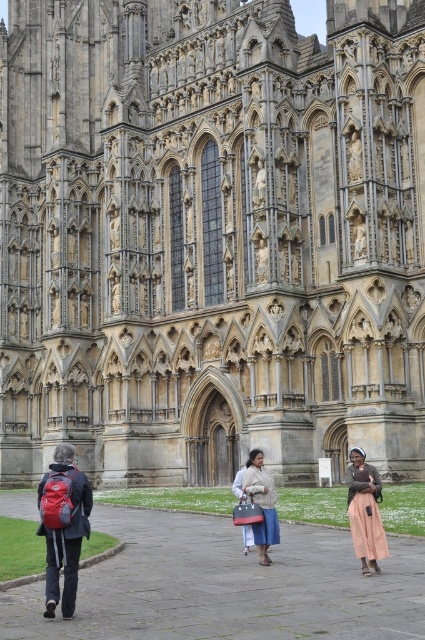
Question: Does peach cotton dress at lower right have a smaller size compared to light brown fabric coat at center?

Choices:
 (A) yes
 (B) no

Answer: (A)

Question: Which object is the farthest from the peach cotton dress at lower right?

Choices:
 (A) light brown fabric coat at center
 (B) light brown fabric bag at center

Answer: (B)

Question: From the image, what is the correct spatial relationship of peach cotton dress at lower right in relation to light brown fabric coat at center?

Choices:
 (A) left
 (B) right

Answer: (B)

Question: Which point is farther to the camera?

Choices:
 (A) light brown fabric coat at center
 (B) light brown fabric bag at center
 (C) red fabric backpack at lower left

Answer: (B)

Question: Based on their relative distances, which object is farther from the peach cotton dress at lower right?

Choices:
 (A) light brown fabric bag at center
 (B) red fabric backpack at lower left

Answer: (B)

Question: Is peach cotton dress at lower right positioned before light brown fabric bag at center?

Choices:
 (A) no
 (B) yes

Answer: (B)